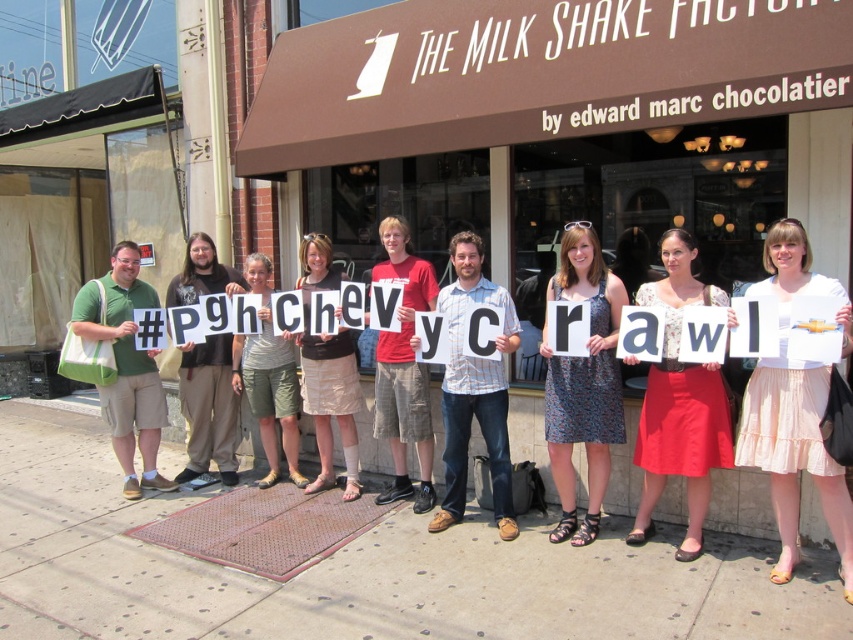
Does matte white dress at center appear over printed fabric dress at center?

Incorrect, matte white dress at center is not positioned above printed fabric dress at center.

Does matte white dress at center have a lesser width compared to printed fabric dress at center?

No.

Identify the location of matte white dress at center. (680, 403).

Which is more to the right, black cotton t-shirt at center or beige fabric skirt at center?

From the viewer's perspective, beige fabric skirt at center appears more on the right side.

Is black cotton t-shirt at center further to camera compared to beige fabric skirt at center?

Yes, it is.

Who is more distant from viewer, (x=207, y=400) or (x=316, y=253)?

The point (x=207, y=400) is behind.

Find the location of a particular element. Image resolution: width=853 pixels, height=640 pixels. black cotton t-shirt at center is located at coordinates (207, 406).

Which is in front, point (610, 273) or point (186, 392)?

Point (610, 273) is in front.

The image size is (853, 640). I want to click on printed fabric dress at center, so click(583, 381).